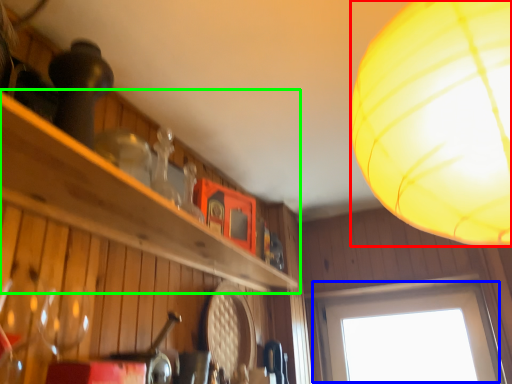
Question: Based on their relative distances, which object is nearer to lamp (highlighted by a red box)? Choose from window (highlighted by a blue box) and shelf (highlighted by a green box).

Choices:
 (A) window
 (B) shelf

Answer: (B)